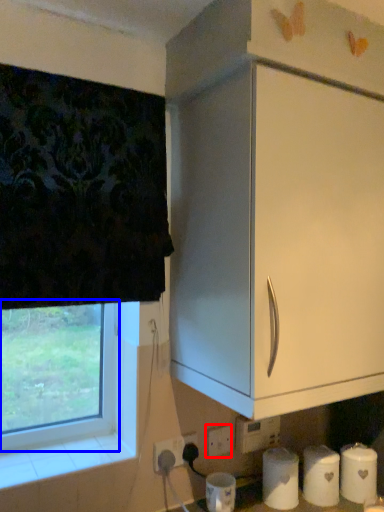
Question: Among these objects, which one is nearest to the camera, electric outlet (highlighted by a red box) or window (highlighted by a blue box)?

Choices:
 (A) electric outlet
 (B) window

Answer: (B)